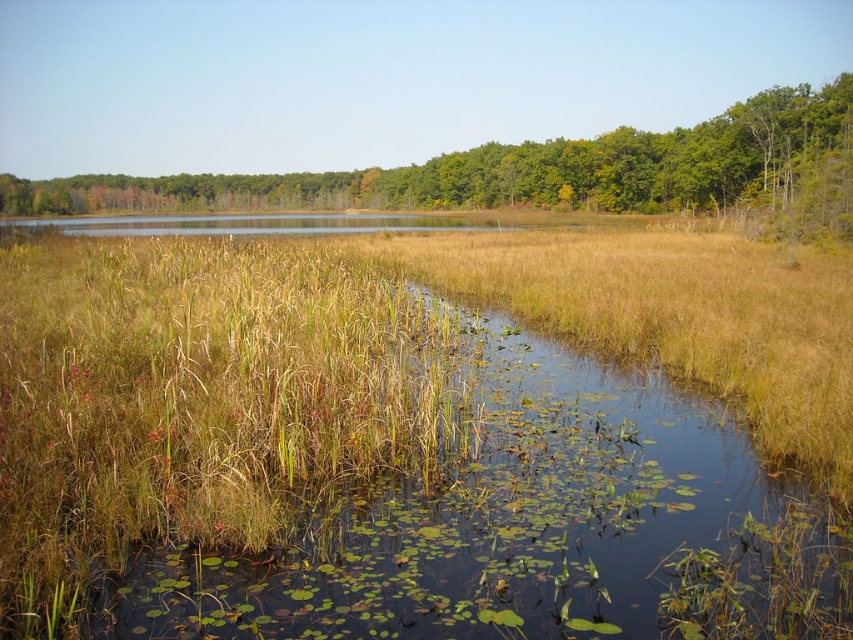
Is point (399, 369) positioned before point (737, 193)?

Yes, point (399, 369) is in front of point (737, 193).

Is green grass at center positioned before green leafy trees at upper center?

That is True.

Between point (715, 314) and point (749, 120), which one is positioned behind?

The point (749, 120) is behind.

This screenshot has height=640, width=853. I want to click on green grass at center, so tap(347, 372).